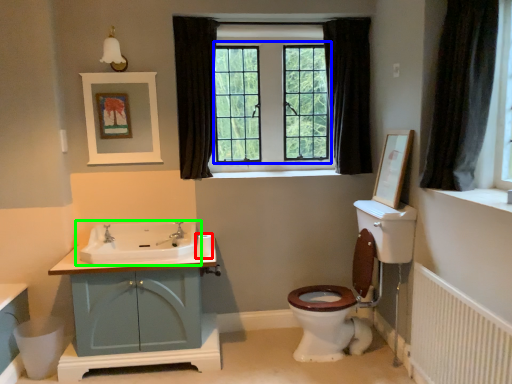
Question: Which object is the farthest from toilet paper (highlighted by a red box)? Choose among these: bay window (highlighted by a blue box) or sink (highlighted by a green box).

Choices:
 (A) bay window
 (B) sink

Answer: (A)